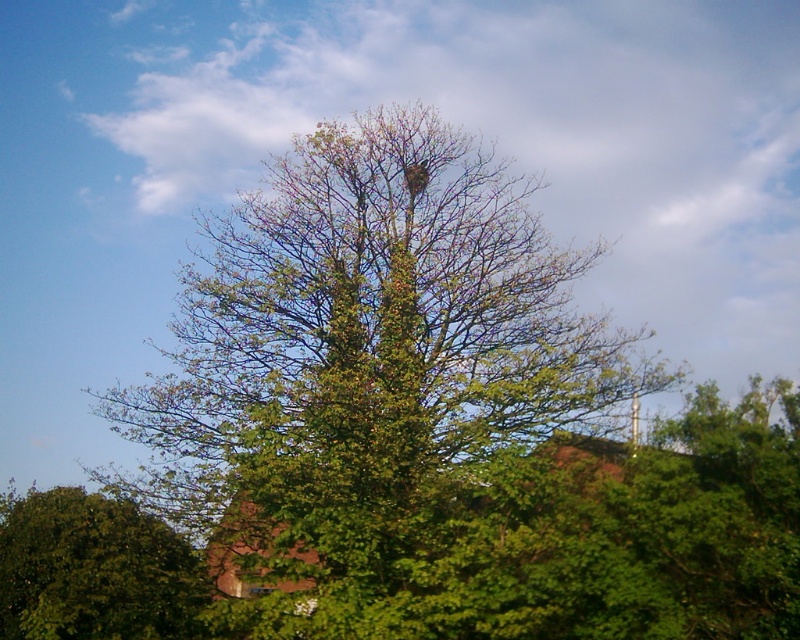
You are standing at the point marked by the coordinates point [392,403] in the image. Based on the scene description, what do you see directly in front of you?

The point [392,403] marks the green leafy tree at center, so you would see the green leafy tree at center directly in front of you.

You are standing in a park and want to take a photo of the green leafy tree at center. If your camera has a maximum focus range of 15 meters, will you need to move closer to the tree to get a clear shot?

The green leafy tree at center is 17.52 meters away from the camera, which exceeds the camera maximum focus range of 15 meters. Therefore, you need to move closer to the tree to get a clear shot.